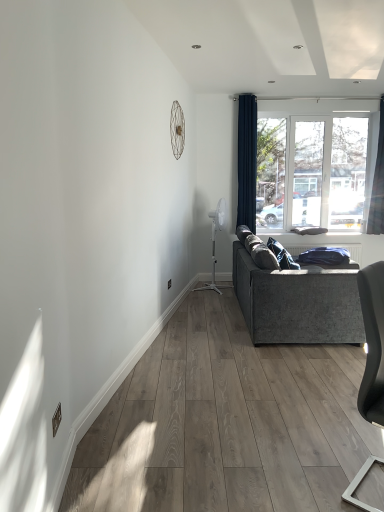
Question: From a real-world perspective, is dark blue fabric curtain at right, placed as the 2th curtain when sorted from left to right, on matte gray chair at lower right?

Choices:
 (A) yes
 (B) no

Answer: (A)

Question: Is dark blue fabric curtain at right, placed as the 1th curtain when sorted from right to left, positioned far away from matte gray chair at lower right?

Choices:
 (A) no
 (B) yes

Answer: (B)

Question: Does dark blue fabric curtain at right, placed as the 1th curtain when sorted from right to left, have a greater height compared to matte gray chair at lower right?

Choices:
 (A) no
 (B) yes

Answer: (B)

Question: Does dark blue fabric curtain at right, placed as the 1th curtain when sorted from right to left, lie behind matte gray chair at lower right?

Choices:
 (A) yes
 (B) no

Answer: (A)

Question: From the image's perspective, is dark blue fabric curtain at right, placed as the 1th curtain when sorted from right to left, on matte gray chair at lower right?

Choices:
 (A) no
 (B) yes

Answer: (B)

Question: Is transparent glass window at upper right to the left or to the right of dark blue fabric curtain at right, placed as the 1th curtain when sorted from right to left, in the image?

Choices:
 (A) left
 (B) right

Answer: (A)

Question: Considering their positions, is transparent glass window at upper right located in front of or behind dark blue fabric curtain at right, placed as the 1th curtain when sorted from right to left?

Choices:
 (A) front
 (B) behind

Answer: (B)

Question: From their relative heights in the image, would you say transparent glass window at upper right is taller or shorter than dark blue fabric curtain at right, placed as the 2th curtain when sorted from left to right?

Choices:
 (A) tall
 (B) short

Answer: (B)

Question: From a real-world perspective, relative to dark blue fabric curtain at right, placed as the 2th curtain when sorted from left to right, is transparent glass window at upper right vertically above or below?

Choices:
 (A) below
 (B) above

Answer: (A)

Question: In terms of width, does transparent glass window at upper right look wider or thinner when compared to matte gray chair at lower right?

Choices:
 (A) wide
 (B) thin

Answer: (B)

Question: From a real-world perspective, is transparent glass window at upper right above or below matte gray chair at lower right?

Choices:
 (A) below
 (B) above

Answer: (B)

Question: Would you say transparent glass window at upper right is inside or outside matte gray chair at lower right?

Choices:
 (A) inside
 (B) outside

Answer: (B)

Question: Is transparent glass window at upper right to the left or to the right of matte gray chair at lower right in the image?

Choices:
 (A) right
 (B) left

Answer: (A)

Question: Is matte gray chair at lower right inside or outside of navy blue fabric curtain at upper right, which is the 1th curtain from left to right?

Choices:
 (A) outside
 (B) inside

Answer: (A)

Question: Looking at the image, does matte gray chair at lower right seem bigger or smaller compared to navy blue fabric curtain at upper right, marked as the second curtain in a right-to-left arrangement?

Choices:
 (A) big
 (B) small

Answer: (B)